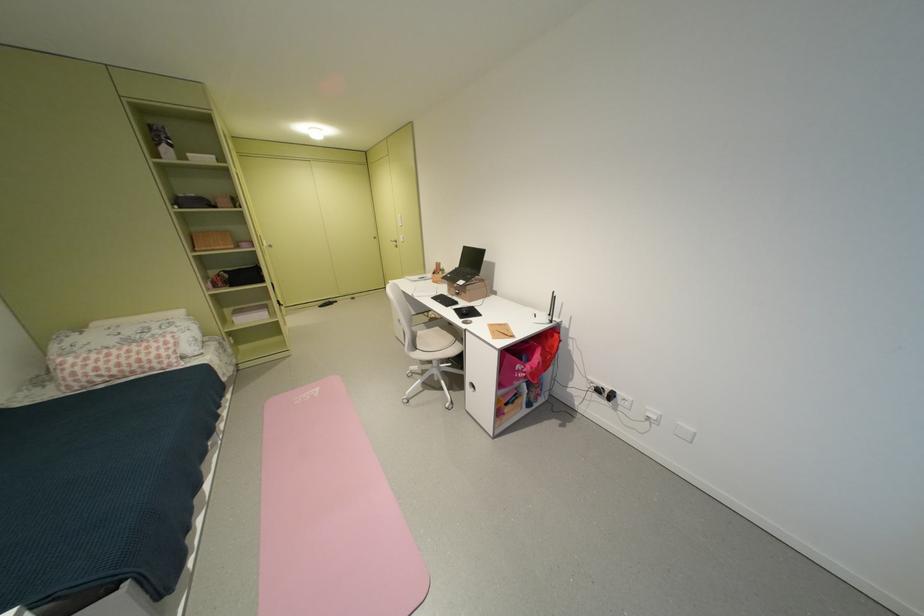
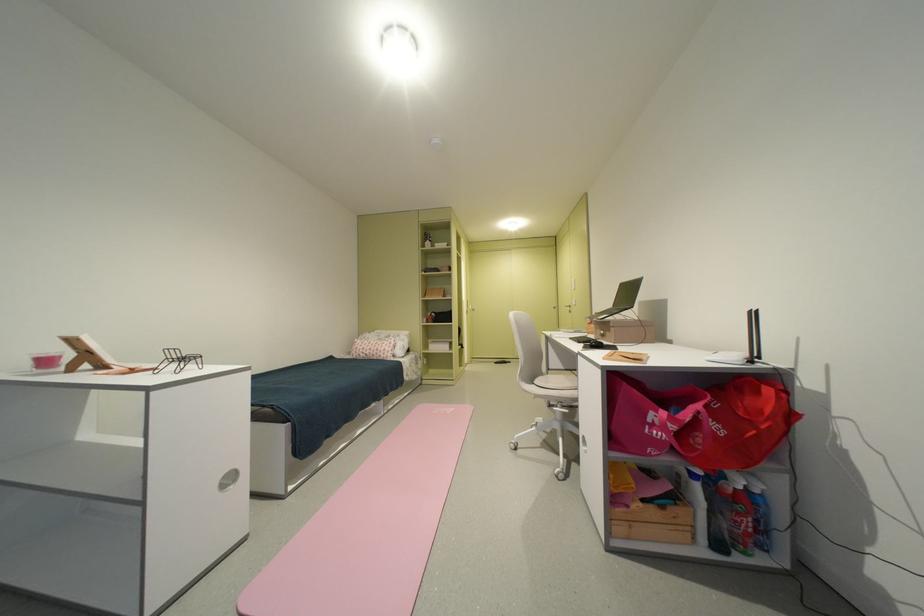
The point at (560, 357) is marked in the first image. Where is the corresponding point in the second image?

(764, 434)